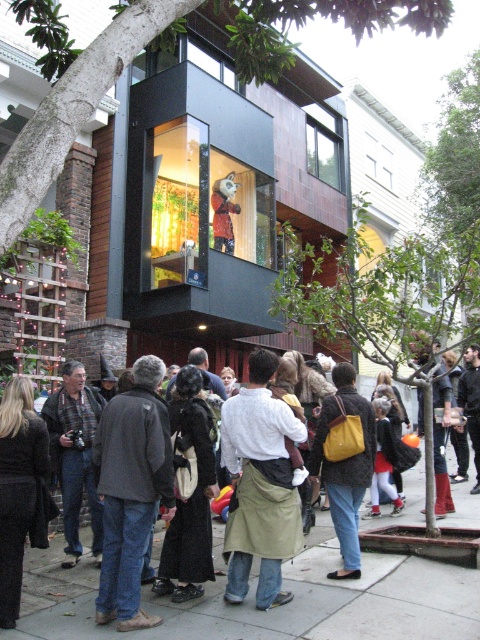
You are standing in front of the modern building and see both the dark gray jacket at center and the matte yellow backpack at center. Which object is positioned to the left of the other?

The dark gray jacket at center is to the left of the matte yellow backpack at center.

You are a delivery person standing on the concrete sidewalk at center and need to place a package on the khaki fabric apron at center. Can you reach it without moving from your current position?

The concrete sidewalk at center is closer to the viewer than the khaki fabric apron at center, so you cannot reach the khaki fabric apron at center from your current position without moving.

You are a delivery person who needs to place a matte yellow backpack at center on the concrete sidewalk at center. Can you safely put the backpack directly on the sidewalk without it falling off?

The concrete sidewalk at center is below matte yellow backpack at center, so placing the backpack directly on the sidewalk would be safe as the sidewalk provides a stable surface beneath it.